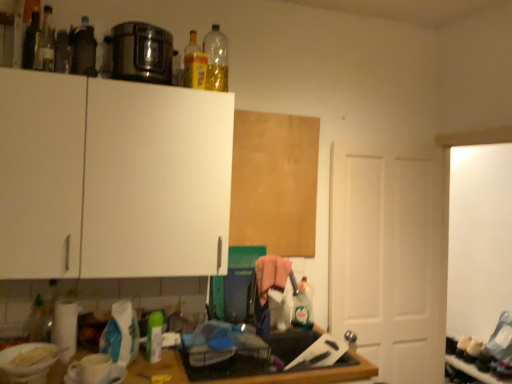
This screenshot has width=512, height=384. Identify the location of translucent yellow bottle at upper center, the fourth bottle ordered from the bottom. (193, 64).

What do you see at coordinates (154, 337) in the screenshot?
I see `green matte spray can at lower center, the 5th bottle viewed from the back` at bounding box center [154, 337].

Describe the element at coordinates (390, 257) in the screenshot. I see `white matte door at right` at that location.

Image resolution: width=512 pixels, height=384 pixels. I want to click on white matte door at right, so click(x=390, y=257).

This screenshot has height=384, width=512. What do you see at coordinates (28, 365) in the screenshot? I see `white plastic bowl at lower left` at bounding box center [28, 365].

Find the location of a particular element. matte black bottle at upper left, the 3th bottle in the left-to-right sequence is located at coordinates (83, 49).

Measure the distance between translucent plastic bottle at lower right, the eighth bottle when ordered from left to right, and camera.

The distance of translucent plastic bottle at lower right, the eighth bottle when ordered from left to right, from camera is 3.15 meters.

This screenshot has width=512, height=384. I want to click on translucent yellow bottle at upper center, marked as the fifth bottle in a left-to-right arrangement, so click(193, 64).

Considering the sizes of objects wooden board at upper center, placed as the second cabinetry when sorted from front to back, and white matte door at right in the image provided, who is smaller, wooden board at upper center, placed as the second cabinetry when sorted from front to back, or white matte door at right?

wooden board at upper center, placed as the second cabinetry when sorted from front to back.

Can we say wooden board at upper center, placed as the second cabinetry when sorted from front to back, lies outside white matte door at right?

Yes, wooden board at upper center, placed as the second cabinetry when sorted from front to back, is outside of white matte door at right.

From a real-world perspective, does wooden board at upper center, placed as the second cabinetry when sorted from front to back, stand above white matte door at right?

Indeed, from a real-world perspective, wooden board at upper center, placed as the second cabinetry when sorted from front to back, stands above white matte door at right.

From the image's perspective, is wooden board at upper center, placed as the second cabinetry when sorted from front to back, beneath white matte door at right?

Actually, wooden board at upper center, placed as the second cabinetry when sorted from front to back, appears above white matte door at right in the image.

Which is more distant, (40,46) or (468,353)?

Positioned behind is point (468,353).

Consider the image. Does translucent glass bottle at upper left, the second bottle positioned from the front, touch translucent plastic bottle at lower right, the first bottle when ordered from back to front?

There is a gap between translucent glass bottle at upper left, the second bottle positioned from the front, and translucent plastic bottle at lower right, the first bottle when ordered from back to front.

Based on the photo, how different are the orientations of translucent glass bottle at upper left, the second bottle positioned from the front, and translucent plastic bottle at lower right, the eighth bottle when ordered from left to right, in degrees?

The angular difference between translucent glass bottle at upper left, the second bottle positioned from the front, and translucent plastic bottle at lower right, the eighth bottle when ordered from left to right, is 81.9 degrees.

Which of these two, translucent glass bottle at upper left, the 7th bottle from the right, or translucent plastic bottle at lower right, marked as the 1th bottle in a right-to-left arrangement, is bigger?

With larger size is translucent plastic bottle at lower right, marked as the 1th bottle in a right-to-left arrangement.

Between point (306, 324) and point (215, 43), which one is positioned in front?

The point (215, 43) is closer to the camera.

Considering the sizes of objects clear plastic bottle at center, which ranks as the 3th bottle in bottom-to-top order, and translucent plastic bottle at upper center, which is the sixth bottle in left-to-right order, in the image provided, who is wider, clear plastic bottle at center, which ranks as the 3th bottle in bottom-to-top order, or translucent plastic bottle at upper center, which is the sixth bottle in left-to-right order,?

clear plastic bottle at center, which ranks as the 3th bottle in bottom-to-top order, is wider.

From the image's perspective, which is below, clear plastic bottle at center, arranged as the 7th bottle when viewed from the left, or translucent plastic bottle at upper center, which is the sixth bottle in left-to-right order?

clear plastic bottle at center, arranged as the 7th bottle when viewed from the left, is shown below in the image.

In the scene shown: Which of these two, wooden board at upper center, which is the 1th cabinetry in right-to-left order, or green matte spray can at lower center, positioned as the 4th bottle in left-to-right order, is wider?

With larger width is green matte spray can at lower center, positioned as the 4th bottle in left-to-right order.

From a real-world perspective, is wooden board at upper center, arranged as the first cabinetry when viewed from the back, physically below green matte spray can at lower center, the 5th bottle viewed from the back?

No, from a real-world perspective, wooden board at upper center, arranged as the first cabinetry when viewed from the back, is not under green matte spray can at lower center, the 5th bottle viewed from the back.

Is wooden board at upper center, which is the 1th cabinetry in right-to-left order, not near green matte spray can at lower center, the fourth bottle from the front?

wooden board at upper center, which is the 1th cabinetry in right-to-left order, is actually quite close to green matte spray can at lower center, the fourth bottle from the front.

From a real-world perspective, is matte black bottle at upper left, the 3th bottle in the left-to-right sequence, physically located above or below white plastic bowl at lower left?

Clearly, from a real-world perspective, matte black bottle at upper left, the 3th bottle in the left-to-right sequence, is above white plastic bowl at lower left.

Is point (91, 73) closer or farther from the camera than point (3, 350)?

Clearly, point (91, 73) is more distant from the camera than point (3, 350).

Looking at this image, from the image's perspective, between matte black bottle at upper left, placed as the 6th bottle when sorted from back to front, and white plastic bowl at lower left, who is located below?

white plastic bowl at lower left is shown below in the image.

In the scene shown: Considering the sizes of objects clear plastic bottle at center, which is counted as the second bottle, starting from the back, and matte glass bottle at upper left, which is counted as the 7th bottle, starting from the bottom, in the image provided, who is shorter, clear plastic bottle at center, which is counted as the second bottle, starting from the back, or matte glass bottle at upper left, which is counted as the 7th bottle, starting from the bottom,?

With less height is matte glass bottle at upper left, which is counted as the 7th bottle, starting from the bottom.

Considering the sizes of objects clear plastic bottle at center, arranged as the 7th bottle when viewed from the left, and matte glass bottle at upper left, which is counted as the 7th bottle, starting from the bottom, in the image provided, who is wider, clear plastic bottle at center, arranged as the 7th bottle when viewed from the left, or matte glass bottle at upper left, which is counted as the 7th bottle, starting from the bottom,?

clear plastic bottle at center, arranged as the 7th bottle when viewed from the left, is wider.

How different are the orientations of clear plastic bottle at center, arranged as the 7th bottle when viewed from the left, and matte glass bottle at upper left, which appears as the first bottle when viewed from the left, in degrees?

They differ by 7.83 degrees in their facing directions.

From the picture: Between translucent plastic bottle at lower right, the first bottle from the bottom, and translucent yellow bottle at upper center, which appears as the sixth bottle when viewed from the front, which one appears on the left side from the viewer's perspective?

translucent yellow bottle at upper center, which appears as the sixth bottle when viewed from the front, is more to the left.

Does translucent plastic bottle at lower right, marked as the 1th bottle in a right-to-left arrangement, have a larger size compared to translucent yellow bottle at upper center, the 4th bottle when ordered from right to left?

Correct, translucent plastic bottle at lower right, marked as the 1th bottle in a right-to-left arrangement, is larger in size than translucent yellow bottle at upper center, the 4th bottle when ordered from right to left.

From the image's perspective, is translucent plastic bottle at lower right, which is counted as the eighth bottle, starting from the front, located beneath translucent yellow bottle at upper center, which appears as the sixth bottle when viewed from the front?

Correct, translucent plastic bottle at lower right, which is counted as the eighth bottle, starting from the front, appears lower than translucent yellow bottle at upper center, which appears as the sixth bottle when viewed from the front, in the image.

Find the location of a particular element. This screenshot has width=512, height=384. bottle that is the 3rd object to the right of the translucent yellow bottle at upper center, the fourth bottle ordered from the bottom, starting at the anchor is located at coordinates (473, 350).

Image resolution: width=512 pixels, height=384 pixels. I want to click on door below the wooden board at upper center, placed as the second cabinetry when sorted from front to back (from a real-world perspective), so click(390, 257).

You are a GUI agent. You are given a task and a screenshot of the screen. Output one action in this format:
    pyautogui.click(x=<x>, y=<y>)
    Task: Click on the 6th bottle located above the translucent plastic bottle at lower right, the first bottle when ordered from back to front (from a real-world perspective)
    
    Given the screenshot: What is the action you would take?
    pyautogui.click(x=45, y=43)

Looking at the image, which one is located further to wooden board at upper center, placed as the second cabinetry when sorted from front to back, white glossy coffee cup at lower left or translucent plastic bottle at lower right, which is counted as the eighth bottle, starting from the front?

Among the two, translucent plastic bottle at lower right, which is counted as the eighth bottle, starting from the front, is located further to wooden board at upper center, placed as the second cabinetry when sorted from front to back.

From the image, which object appears to be farther from metallic silver pressure cooker at upper center, white matte cabinet at upper left, the 1th cabinetry when ordered from left to right, or translucent glass bottle at upper left, which is the third bottle from top to bottom?

white matte cabinet at upper left, the 1th cabinetry when ordered from left to right.

Estimate the real-world distances between objects in this image. Which object is further from green matte spray can at lower center, positioned as the 4th bottle in left-to-right order, translucent plastic bottle at upper center, which is counted as the third bottle, starting from the right, or translucent yellow bottle at upper center, the 4th bottle when ordered from right to left?

translucent plastic bottle at upper center, which is counted as the third bottle, starting from the right.

Which object lies further to the anchor point translucent glass bottle at upper left, the 2th bottle in the left-to-right sequence, white matte door at right or metallic silver pressure cooker at upper center?

white matte door at right is positioned further to the anchor translucent glass bottle at upper left, the 2th bottle in the left-to-right sequence.

Based on their spatial positions, is wooden board at upper center, the 2th cabinetry viewed from the left, or white matte cabinet at upper left, the 1th cabinetry when ordered from left to right, further from translucent plastic bottle at upper center, which is the sixth bottle in left-to-right order?

white matte cabinet at upper left, the 1th cabinetry when ordered from left to right, lies further to translucent plastic bottle at upper center, which is the sixth bottle in left-to-right order, than the other object.

Which object lies nearer to the anchor point clear plastic bottle at center, which is counted as the 6th bottle, starting from the top, translucent yellow bottle at upper center, placed as the 3th bottle when sorted from back to front, or translucent glass bottle at upper left, acting as the seventh bottle starting from the back?

The object closer to clear plastic bottle at center, which is counted as the 6th bottle, starting from the top, is translucent yellow bottle at upper center, placed as the 3th bottle when sorted from back to front.

In the scene shown: Which object lies further to the anchor point translucent plastic bottle at upper center, which appears as the fourth bottle when viewed from the back, white glossy coffee cup at lower left or matte black bottle at upper left, which appears as the sixth bottle when viewed from the right?

white glossy coffee cup at lower left is positioned further to the anchor translucent plastic bottle at upper center, which appears as the fourth bottle when viewed from the back.

Based on their spatial positions, is metallic silver pressure cooker at upper center or translucent yellow bottle at upper center, marked as the fifth bottle in a left-to-right arrangement, further from white matte door at right?

Among the two, translucent yellow bottle at upper center, marked as the fifth bottle in a left-to-right arrangement, is located further to white matte door at right.

Locate an element on the screen. The height and width of the screenshot is (384, 512). coffee cup between white plastic bowl at lower left and translucent plastic bottle at lower right, the eighth bottle when ordered from top to bottom is located at coordinates (90, 369).

Locate an element on the screen. Image resolution: width=512 pixels, height=384 pixels. coffee cup located between matte glass bottle at upper left, which appears as the 8th bottle when viewed from the right, and white matte door at right in the left-right direction is located at coordinates (90, 369).

This screenshot has height=384, width=512. In order to click on cabinetry between metallic silver pressure cooker at upper center and translucent plastic bottle at lower right, which is counted as the eighth bottle, starting from the front, in the horizontal direction in this screenshot , I will do `click(274, 182)`.

In order to click on cabinetry between translucent glass bottle at upper left, the 7th bottle from the right, and wooden board at upper center, placed as the second cabinetry when sorted from front to back, in the horizontal direction in this screenshot , I will do `click(111, 177)`.